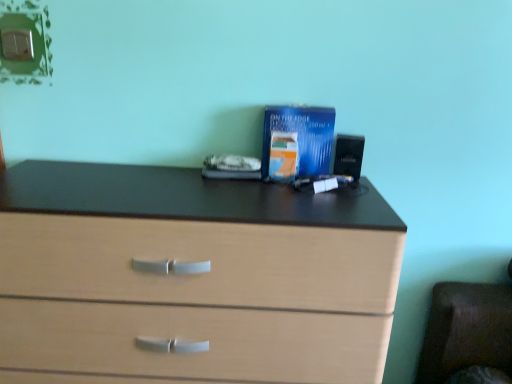
Where is `empty space that is to the right of blue glossy paperback book at center, which is the 2th paperback book from back to front`? This screenshot has height=384, width=512. empty space that is to the right of blue glossy paperback book at center, which is the 2th paperback book from back to front is located at coordinates [344, 191].